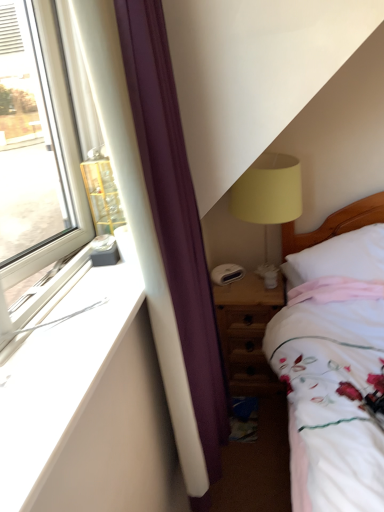
Question: From a real-world perspective, is wooden nightstand at lower right above or below matte yellow fabric lampshade at upper right?

Choices:
 (A) above
 (B) below

Answer: (B)

Question: Looking at their shapes, would you say wooden nightstand at lower right is wider or thinner than matte yellow fabric lampshade at upper right?

Choices:
 (A) wide
 (B) thin

Answer: (A)

Question: Which object is the closest to the white smooth window sill at left?

Choices:
 (A) matte yellow fabric lampshade at upper right
 (B) white soft pillow at right
 (C) wooden nightstand at lower right

Answer: (A)

Question: Based on their relative distances, which object is nearer to the white soft pillow at right?

Choices:
 (A) white smooth window sill at left
 (B) wooden nightstand at lower right
 (C) matte yellow fabric lampshade at upper right

Answer: (C)